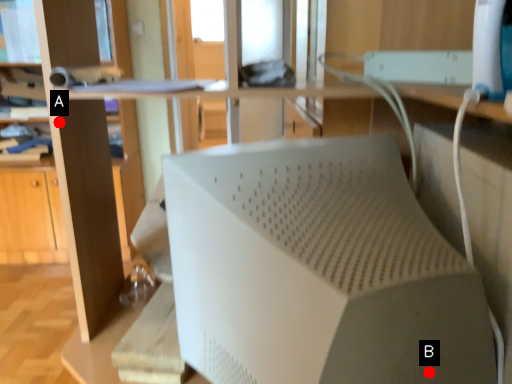
Question: Two points are circled on the image, labeled by A and B beside each circle. Which point appears farthest from the camera in this image?

Choices:
 (A) A is further
 (B) B is further

Answer: (A)